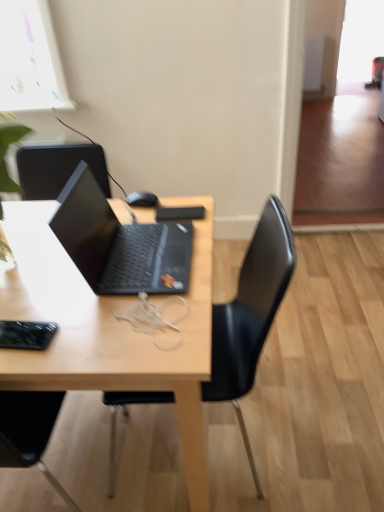
Question: Can you confirm if wooden desk at center is positioned to the right of black matte mouse at center?

Choices:
 (A) no
 (B) yes

Answer: (A)

Question: Considering the relative sizes of wooden desk at center and black matte mouse at center in the image provided, is wooden desk at center smaller than black matte mouse at center?

Choices:
 (A) yes
 (B) no

Answer: (B)

Question: Is wooden desk at center aimed at black matte mouse at center?

Choices:
 (A) yes
 (B) no

Answer: (B)

Question: Is wooden desk at center positioned beyond the bounds of black matte mouse at center?

Choices:
 (A) no
 (B) yes

Answer: (B)

Question: From a real-world perspective, is wooden desk at center beneath black matte mouse at center?

Choices:
 (A) yes
 (B) no

Answer: (A)

Question: Is point (82, 263) positioned closer to the camera than point (216, 325)?

Choices:
 (A) farther
 (B) closer

Answer: (B)

Question: Is matte black laptop at center bigger or smaller than black plastic chair at center?

Choices:
 (A) small
 (B) big

Answer: (A)

Question: In the image, is matte black laptop at center positioned in front of or behind black plastic chair at center?

Choices:
 (A) front
 (B) behind

Answer: (B)

Question: From the image's perspective, is matte black laptop at center located above or below black plastic chair at center?

Choices:
 (A) above
 (B) below

Answer: (A)

Question: Which is correct: black plastic chair at center is inside transparent glass window at upper right, or outside of it?

Choices:
 (A) outside
 (B) inside

Answer: (A)

Question: From the image's perspective, is black plastic chair at center above or below transparent glass window at upper right?

Choices:
 (A) below
 (B) above

Answer: (A)

Question: Is point (220, 358) positioned closer to the camera than point (369, 41)?

Choices:
 (A) closer
 (B) farther

Answer: (A)

Question: Based on their sizes in the image, would you say black plastic chair at center is bigger or smaller than transparent glass window at upper right?

Choices:
 (A) small
 (B) big

Answer: (B)

Question: In terms of size, does black matte mouse at center appear bigger or smaller than transparent glass window at upper right?

Choices:
 (A) big
 (B) small

Answer: (B)

Question: Is point (140, 196) positioned closer to the camera than point (382, 28)?

Choices:
 (A) farther
 (B) closer

Answer: (B)